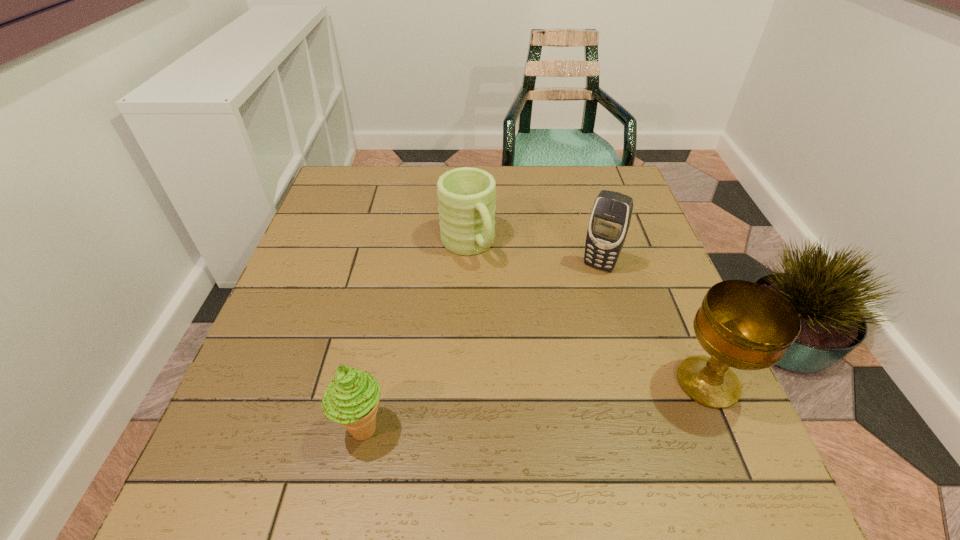
Identify the location of the leftmost object. This screenshot has height=540, width=960. (351, 399).

You are a GUI agent. You are given a task and a screenshot of the screen. Output one action in this format:
    pyautogui.click(x=<x>, y=<y>)
    Task: Click on the chalice
    
    Given the screenshot: What is the action you would take?
    pyautogui.click(x=741, y=324)

Identify the location of cellular telephone. Image resolution: width=960 pixels, height=540 pixels. (609, 222).

Find the location of a particular element. mug is located at coordinates (466, 196).

Image resolution: width=960 pixels, height=540 pixels. What are the coordinates of `free space located 0.070m on the back of the leftmost object` in the screenshot? It's located at (374, 371).

Locate an element on the screen. Image resolution: width=960 pixels, height=540 pixels. free location located on the left of the chalice is located at coordinates (513, 382).

The width and height of the screenshot is (960, 540). I want to click on vacant space located on the front face of the cellular telephone, so click(580, 301).

You are a GUI agent. You are given a task and a screenshot of the screen. Output one action in this format:
    pyautogui.click(x=<x>, y=<y>)
    Task: Click on the vacant space situated 0.180m on the front face of the cellular telephone
    This screenshot has height=540, width=960.
    Given the screenshot: What is the action you would take?
    pyautogui.click(x=567, y=326)

This screenshot has height=540, width=960. Identify the location of vacant area situated on the front face of the cellular telephone. (567, 326).

Locate an element on the screen. This screenshot has width=960, height=540. free location located 0.240m on the side of the mug with the handle is located at coordinates (528, 340).